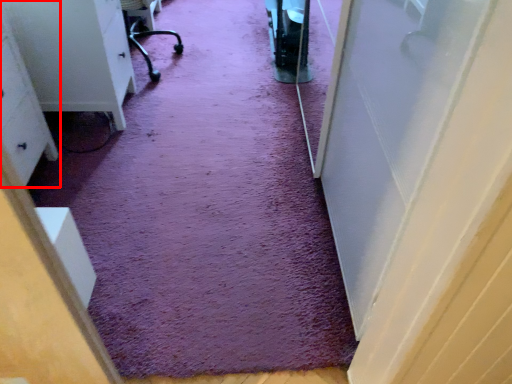
Question: Observing the image, what is the correct spatial positioning of furniture (annotated by the red box) in reference to doormat?

Choices:
 (A) right
 (B) left

Answer: (B)